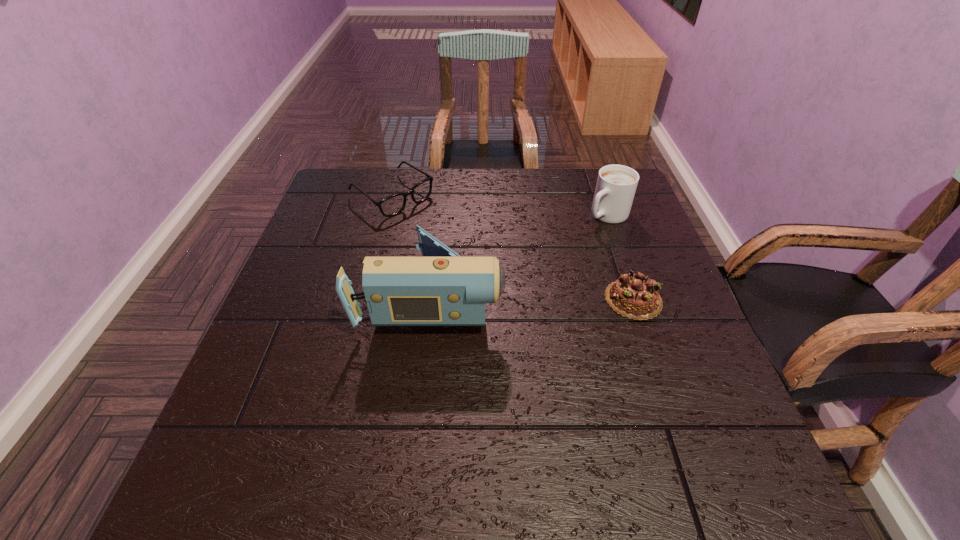
Locate an element on the screen. vacant spot on the desktop that is between the tallest object and the chocolate cake and is positioned on the side with the handle of the cappuccino is located at coordinates (505, 297).

I want to click on vacant space on the desktop that is between the camcorder and the chocolate cake and is positioned on the front-facing side of the spectacles, so click(540, 298).